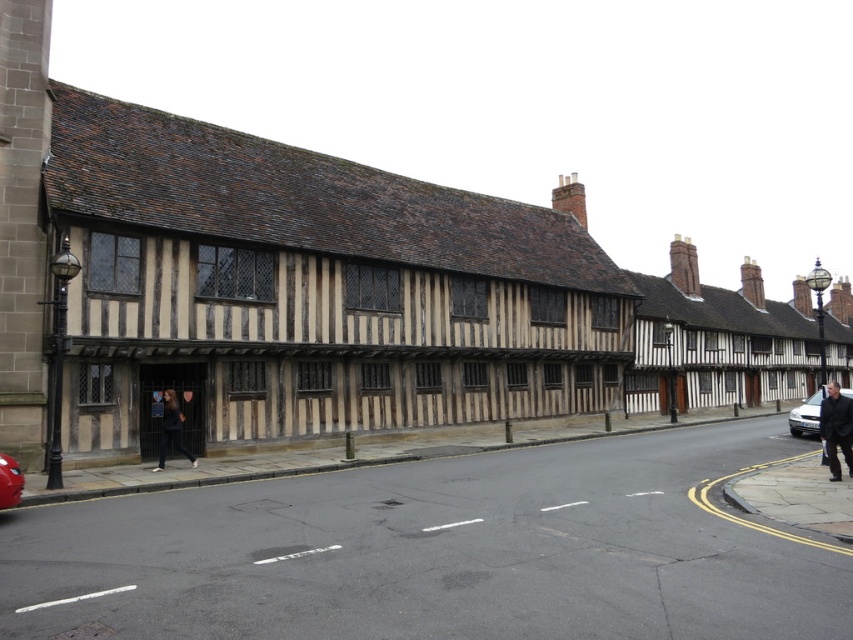
Question: Can you confirm if black fabric coat at lower right is bigger than dark blue jeans at lower left?

Choices:
 (A) no
 (B) yes

Answer: (B)

Question: Is dark blue jeans at lower left positioned at the back of silver metallic sedan at right?

Choices:
 (A) no
 (B) yes

Answer: (B)

Question: Which of the following is the farthest from the observer?

Choices:
 (A) black fabric coat at lower right
 (B) metallic red car at lower left
 (C) dark blue jeans at lower left

Answer: (C)

Question: Which point appears farthest from the camera in this image?

Choices:
 (A) (160, 449)
 (B) (824, 444)
 (C) (805, 424)

Answer: (C)

Question: Which point is closer to the camera taking this photo?

Choices:
 (A) (15, 484)
 (B) (164, 404)

Answer: (A)

Question: Is silver metallic sedan at right above metallic red car at lower left?

Choices:
 (A) yes
 (B) no

Answer: (B)